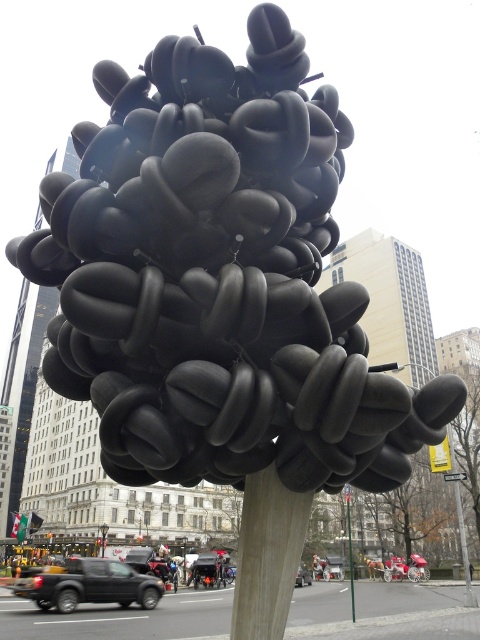
Question: Does matte black sculpture at center have a greater width compared to smooth gray pole at center?

Choices:
 (A) yes
 (B) no

Answer: (A)

Question: Is the position of matte black sculpture at center more distant than that of smooth gray pole at center?

Choices:
 (A) yes
 (B) no

Answer: (B)

Question: Which object is closer to the camera taking this photo?

Choices:
 (A) smooth gray pole at center
 (B) matte black sculpture at center

Answer: (B)

Question: Among these objects, which one is nearest to the camera?

Choices:
 (A) smooth gray pole at center
 (B) matte black sculpture at center

Answer: (B)

Question: From the image, what is the correct spatial relationship of matte black sculpture at center in relation to smooth gray pole at center?

Choices:
 (A) right
 (B) left

Answer: (B)

Question: Which point is closer to the camera?

Choices:
 (A) (113, 262)
 (B) (346, 499)

Answer: (A)